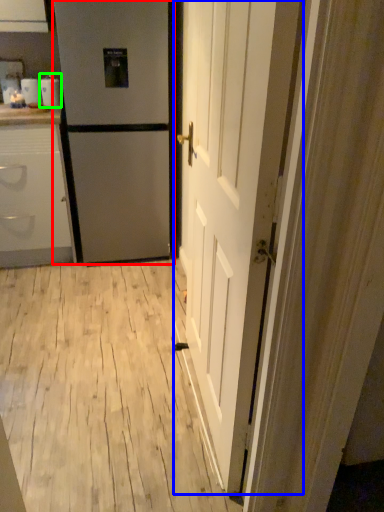
Question: Based on their relative distances, which object is farther from refrigerator (highlighted by a red box)? Choose from door (highlighted by a blue box) and appliance (highlighted by a green box).

Choices:
 (A) door
 (B) appliance

Answer: (A)